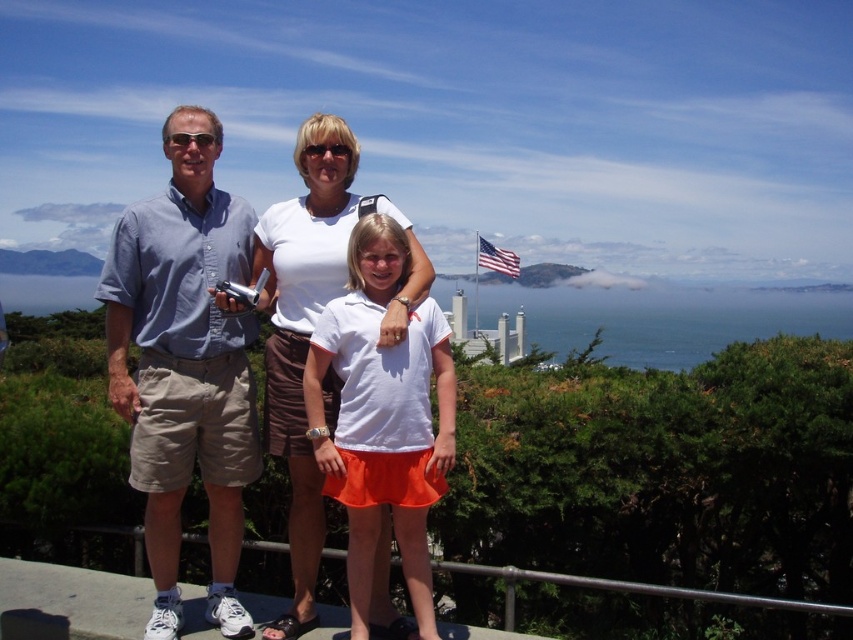
You are standing at the scenic overlook and want to take a photo of the point located at coordinate point (149, 509). Your camera has a maximum focus range of 40 feet. Will you be able to focus on that point?

The point at coordinate point (149, 509) is 42.21 feet away from the viewer, which exceeds the camera maximum focus range of 40 feet. Therefore, you won not be able to focus on that point.

You are standing at the point marked by the coordinates point (422, 548). You want to walk to the nearest exit, which is located 10 meters away from your current position. Is the exit within walking distance?

The distance between point (422, 548) and the viewer is 12.63 meters. Since the exit is 10 meters away, it is closer than the current distance, so the exit is within walking distance.